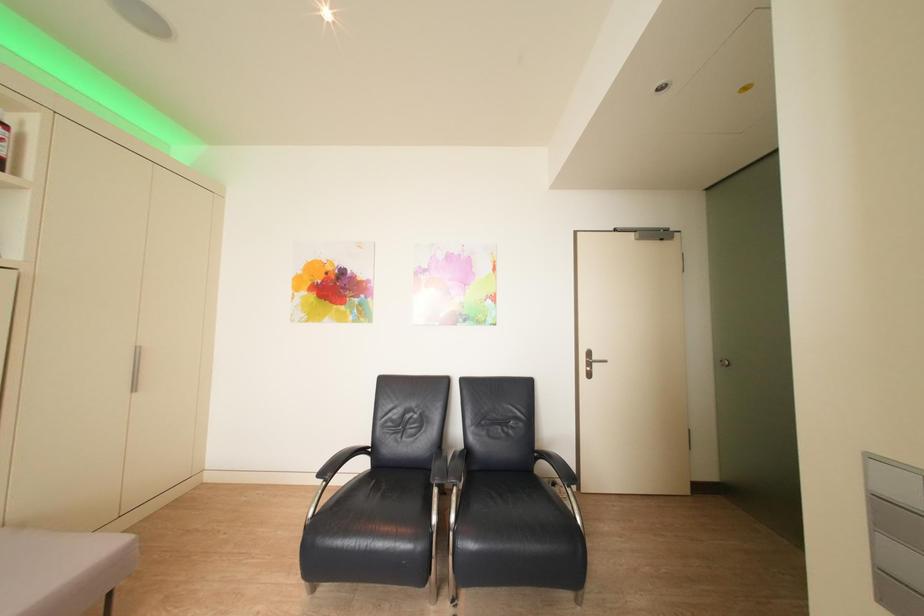
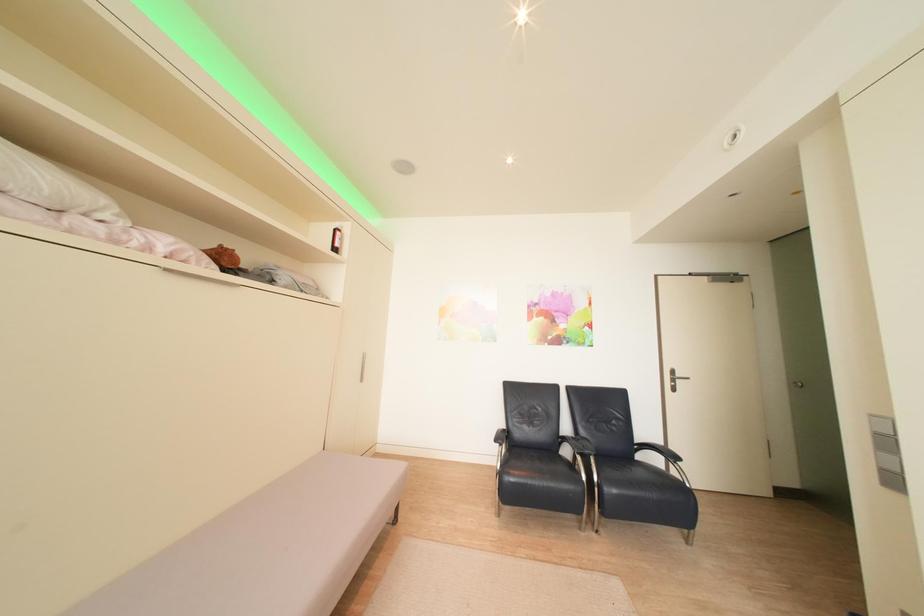
In a continuous first-person perspective shot, in which direction is the camera moving?

The movement direction of the cameraman is left, backward.